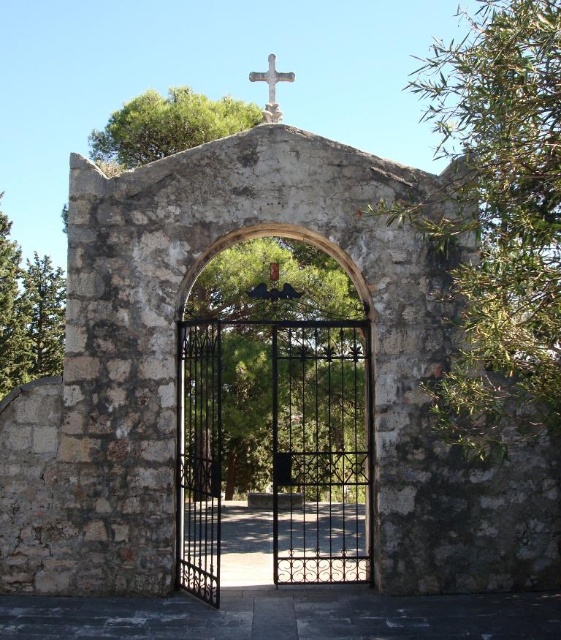
Between black wrought iron gate at center and white stone cross at upper center, which one appears on the right side from the viewer's perspective?

Positioned to the right is black wrought iron gate at center.

Which is below, black wrought iron gate at center or white stone cross at upper center?

black wrought iron gate at center is below.

In order to click on black wrought iron gate at center in this screenshot , I will do `click(275, 416)`.

I want to click on black wrought iron gate at center, so click(275, 416).